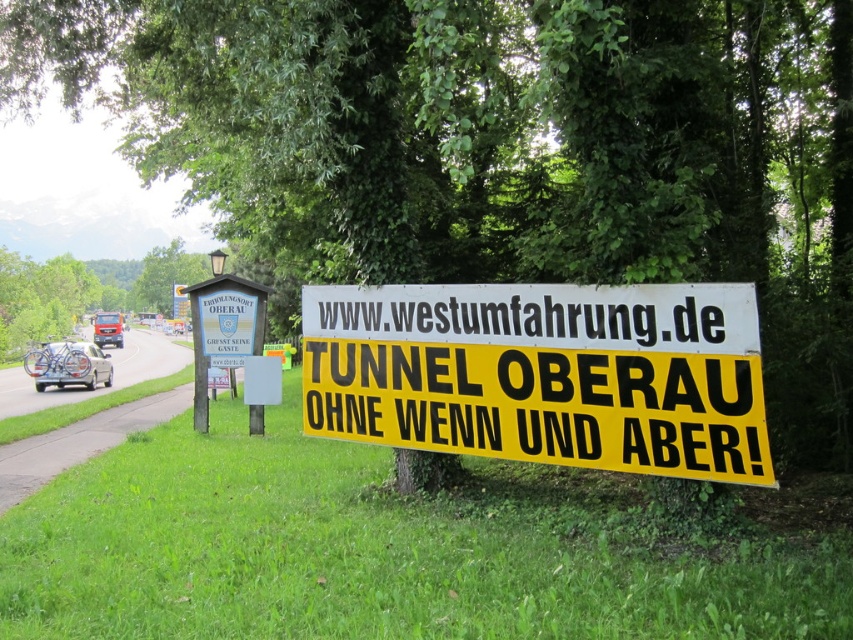
You are driving a car and see the yellow paper sign at center and the metallic silver van at left. Which object is closer to the road?

The yellow paper sign at center is closer to the road because it is positioned below the metallic silver van at left, indicating it is in a lower, more forward position relative to the road.

You are driving a car and see the yellow paper sign at center and the metallic silver van at left. Which object is closer to you?

The yellow paper sign at center is closer to you because it is in front of the metallic silver van at left.

You are driving a car and see the wooden signboard at left and the metallic silver van at left. Which object is wider?

The metallic silver van at left is wider than the wooden signboard at left.